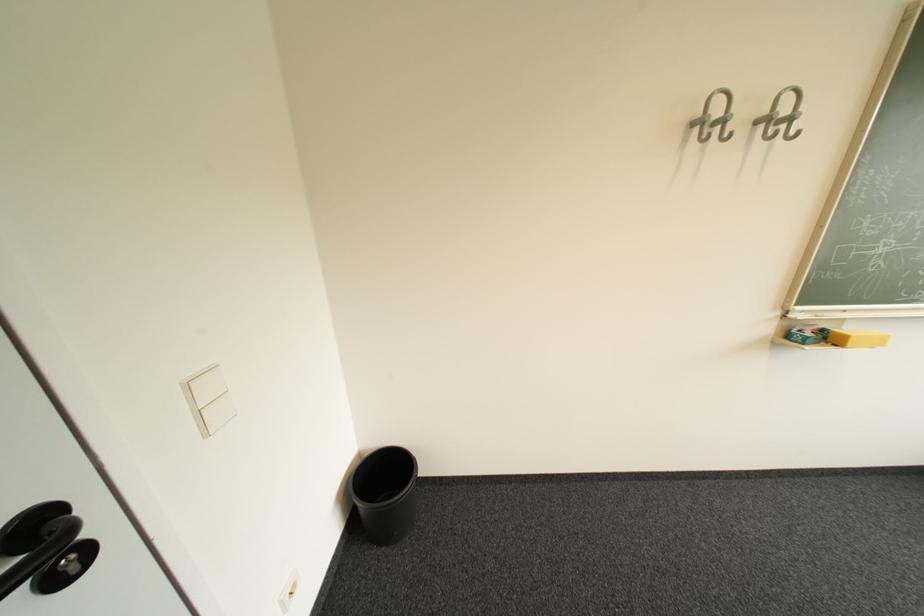
Where would you lift the yellow board eraser? Please return your answer as a coordinate pair (x, y).

(857, 338)